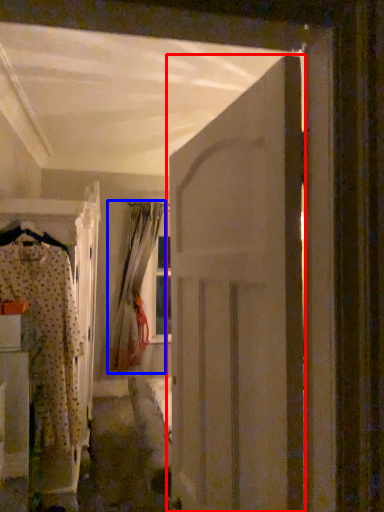
Question: Which object appears closest to the camera in this image, door (highlighted by a red box) or curtain (highlighted by a blue box)?

Choices:
 (A) door
 (B) curtain

Answer: (A)